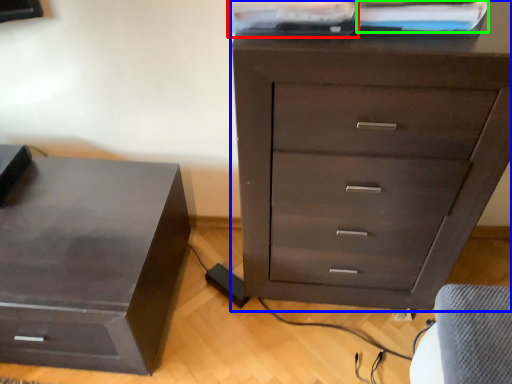
Question: Estimate the real-world distances between objects in this image. Which object is farther from book (highlighted by a red box), chest of drawers (highlighted by a blue box) or book (highlighted by a green box)?

Choices:
 (A) chest of drawers
 (B) book

Answer: (A)